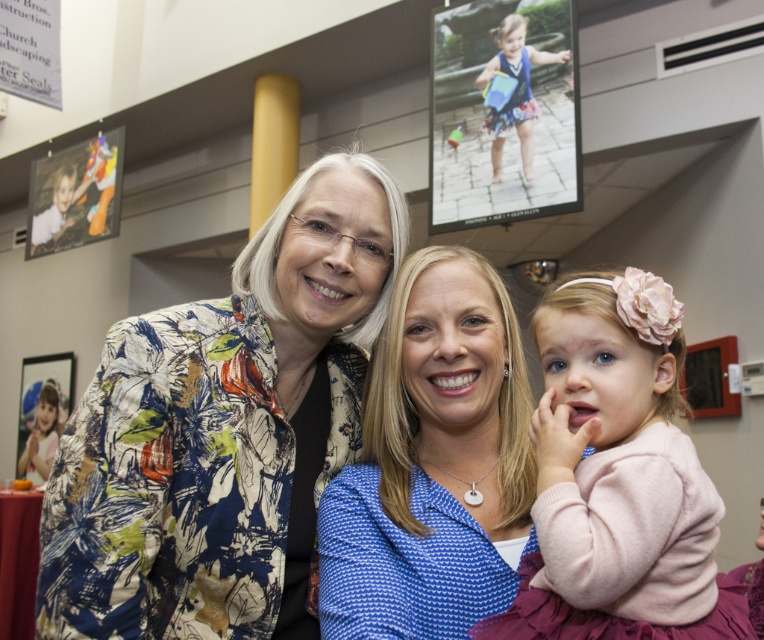
Is floral-patterned jacket at center below pink fabric dress at center?

Incorrect, floral-patterned jacket at center is not positioned below pink fabric dress at center.

Identify the location of floral-patterned jacket at center. (225, 429).

Can you confirm if floral-patterned jacket at center is positioned to the right of blue fabric dress at upper center?

No, floral-patterned jacket at center is not to the right of blue fabric dress at upper center.

Between point (384, 257) and point (568, 51), which one is positioned behind?

Positioned behind is point (568, 51).

Locate an element on the screen. This screenshot has width=764, height=640. floral-patterned jacket at center is located at coordinates [x=225, y=429].

Who is higher up, floral-patterned jacket at upper left or pink fabric dress at center?

pink fabric dress at center is higher up.

Does point (324, 540) lie behind point (703, 616)?

Yes, point (324, 540) is farther from viewer.

Where is `floral-patterned jacket at upper left`? floral-patterned jacket at upper left is located at coordinates (431, 461).